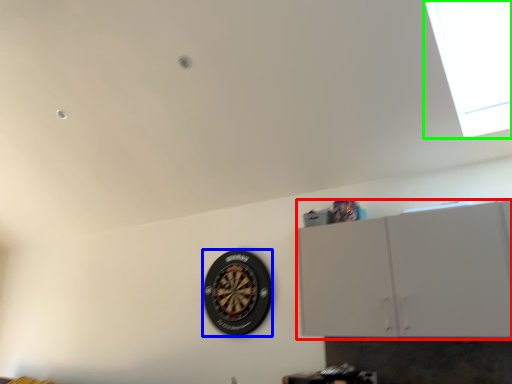
Question: Which object is the farthest from cabinetry (highlighted by a red box)? Choose among these: wheel (highlighted by a blue box) or window (highlighted by a green box).

Choices:
 (A) wheel
 (B) window

Answer: (A)